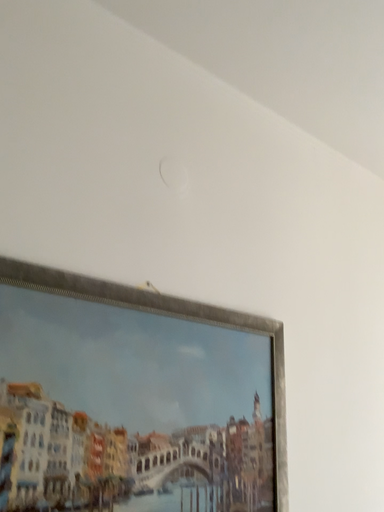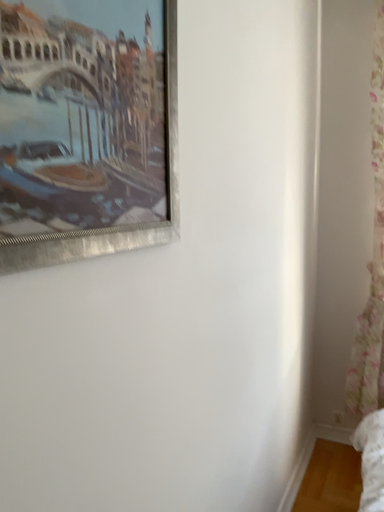
Question: Which way did the camera rotate in the video?

Choices:
 (A) rotated left
 (B) rotated right

Answer: (B)